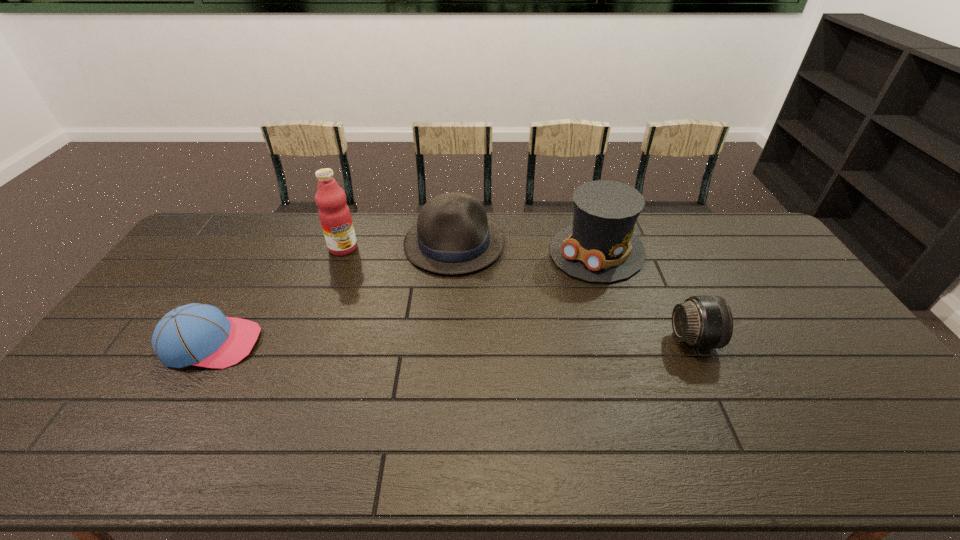
In order to click on dress hat at the far edge in this screenshot , I will do click(600, 246).

Locate an element on the screen. The image size is (960, 540). fruit juice located in the far edge section of the desktop is located at coordinates (334, 214).

Locate an element on the screen. object that is at the left edge is located at coordinates (195, 334).

In the image, there is a desktop. Where is `free space at the far edge`? free space at the far edge is located at coordinates (266, 215).

Find the location of `vacant region at the near edge of the desktop`. vacant region at the near edge of the desktop is located at coordinates click(381, 405).

This screenshot has width=960, height=540. In the image, there is a desktop. Find the location of `vacant space at the left edge`. vacant space at the left edge is located at coordinates (210, 259).

Locate an element on the screen. The height and width of the screenshot is (540, 960). vacant area at the right edge of the desktop is located at coordinates (768, 274).

Find the location of a particular element. Image resolution: width=960 pixels, height=540 pixels. free region at the near right corner of the desktop is located at coordinates click(890, 408).

Locate an element on the screen. The image size is (960, 540). unoccupied position between the leftmost object and the telephoto lens is located at coordinates (452, 341).

At what (x,y) coordinates should I click in order to perform the action: click on vacant space that's between the telephoto lens and the dress hat. Please return your answer as a coordinate pair (x, y). Image resolution: width=960 pixels, height=540 pixels. Looking at the image, I should click on (645, 295).